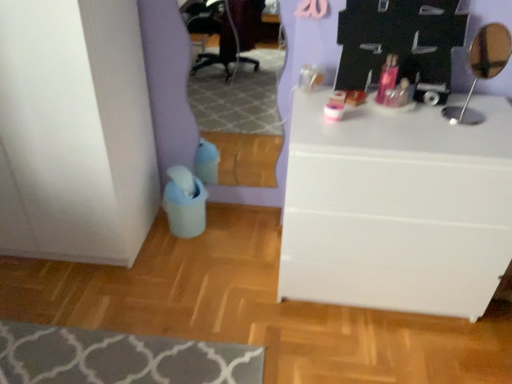
This screenshot has width=512, height=384. In order to click on unoccupied space behind gray textured rug at lower left in this screenshot , I will do `click(165, 287)`.